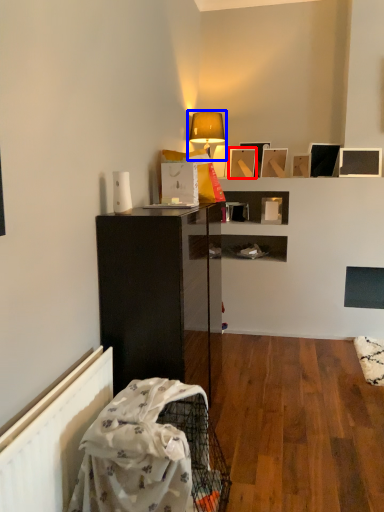
Question: Which point is closer to the camera, picture frame (highlighted by a red box) or lamp (highlighted by a blue box)?

Choices:
 (A) picture frame
 (B) lamp

Answer: (B)